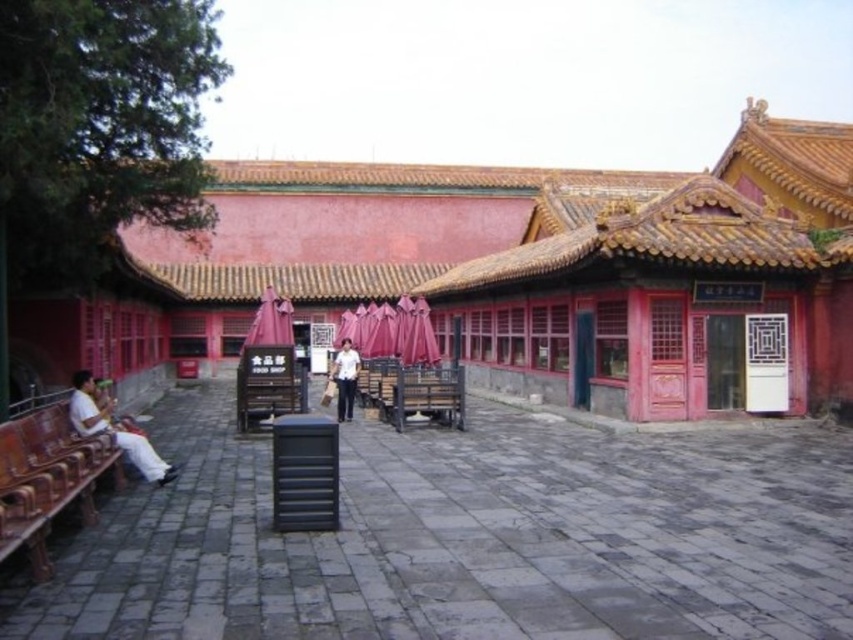
Question: From the image, what is the correct spatial relationship of wooden bench at center in relation to white cotton shirt at left?

Choices:
 (A) left
 (B) right

Answer: (B)

Question: Which object appears closest to the camera in this image?

Choices:
 (A) wooden bench at lower left
 (B) matte red building at center

Answer: (A)

Question: Which of these objects is positioned closest to the matte red building at center?

Choices:
 (A) white matte shirt at center
 (B) white cotton shirt at left
 (C) wooden bench at center
 (D) wooden bench at lower left

Answer: (C)

Question: Which object is the farthest from the white matte shirt at center?

Choices:
 (A) white cotton shirt at left
 (B) matte red building at center
 (C) wooden bench at lower left

Answer: (C)

Question: Is matte red building at center positioned before wooden bench at center?

Choices:
 (A) no
 (B) yes

Answer: (B)

Question: Is white cotton shirt at left wider than white matte shirt at center?

Choices:
 (A) yes
 (B) no

Answer: (A)